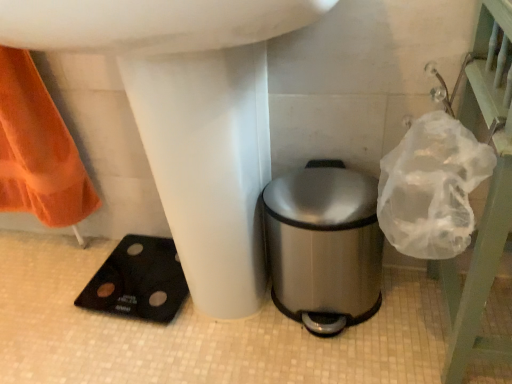
What is the approximate height of stainless steel trash can at lower right?

stainless steel trash can at lower right is 12.86 inches in height.

The height and width of the screenshot is (384, 512). In order to click on white glossy sink at center in this screenshot , I will do `click(189, 117)`.

Considering the relative sizes of white glossy sink at center and stainless steel trash can at lower right in the image provided, is white glossy sink at center shorter than stainless steel trash can at lower right?

Incorrect, the height of white glossy sink at center does not fall short of that of stainless steel trash can at lower right.

Considering the points (156, 167) and (291, 270), which point is behind, point (156, 167) or point (291, 270)?

The point (291, 270) is farther.

Considering the relative sizes of white glossy sink at center and stainless steel trash can at lower right in the image provided, is white glossy sink at center smaller than stainless steel trash can at lower right?

Incorrect, white glossy sink at center is not smaller in size than stainless steel trash can at lower right.

How far apart are white glossy sink at center and stainless steel trash can at lower right?

white glossy sink at center is 7.47 inches away from stainless steel trash can at lower right.

Is white glossy sink at center oriented away from clear plastic bag at upper right?

white glossy sink at center is not turned away from clear plastic bag at upper right.

Would you say white glossy sink at center is inside or outside clear plastic bag at upper right?

white glossy sink at center is not enclosed by clear plastic bag at upper right.

Considering the relative sizes of white glossy sink at center and clear plastic bag at upper right in the image provided, is white glossy sink at center bigger than clear plastic bag at upper right?

Yes, white glossy sink at center is bigger than clear plastic bag at upper right.

Is white glossy sink at center far from clear plastic bag at upper right?

No, white glossy sink at center is not far from clear plastic bag at upper right.

This screenshot has width=512, height=384. In the image, there is a stainless steel trash can at lower right. Find the location of `balustrade above it (from the image's perspective)`. balustrade above it (from the image's perspective) is located at coordinates (488, 192).

Which object is more forward, clear plastic bag at upper right or stainless steel trash can at lower right?

clear plastic bag at upper right is closer to the camera.

Consider the image. Is clear plastic bag at upper right oriented towards stainless steel trash can at lower right?

Yes, clear plastic bag at upper right is facing stainless steel trash can at lower right.

Who is smaller, clear plastic bag at upper right or stainless steel trash can at lower right?

stainless steel trash can at lower right is smaller.

The height and width of the screenshot is (384, 512). What are the coordinates of `waste container on the left of clear plastic bag at upper right` in the screenshot? It's located at (324, 246).

From the image's perspective, between stainless steel trash can at lower right and clear plastic bag at upper right, who is located below?

stainless steel trash can at lower right.

From a real-world perspective, which is physically above, stainless steel trash can at lower right or clear plastic bag at upper right?

In real-world perspective, clear plastic bag at upper right is above.

Find the location of `waste container on the right of white glossy sink at center`. waste container on the right of white glossy sink at center is located at coordinates (324, 246).

How many degrees apart are the facing directions of stainless steel trash can at lower right and white glossy sink at center?

There is a 4.16-degree angle between the facing directions of stainless steel trash can at lower right and white glossy sink at center.

From the image's perspective, which one is positioned higher, stainless steel trash can at lower right or white glossy sink at center?

white glossy sink at center.

Does stainless steel trash can at lower right touch white glossy sink at center?

stainless steel trash can at lower right is not next to white glossy sink at center, and they're not touching.

Which object is positioned more to the right, clear plastic bag at upper right or white glossy sink at center?

clear plastic bag at upper right.

From a real-world perspective, is clear plastic bag at upper right under white glossy sink at center?

Indeed, from a real-world perspective, clear plastic bag at upper right is positioned beneath white glossy sink at center.

In the scene shown: Considering the sizes of clear plastic bag at upper right and white glossy sink at center in the image, is clear plastic bag at upper right wider or thinner than white glossy sink at center?

clear plastic bag at upper right is thinner than white glossy sink at center.

Locate an element on the screen. sink lying above the stainless steel trash can at lower right (from the image's perspective) is located at coordinates (189, 117).

Locate an element on the screen. Image resolution: width=512 pixels, height=384 pixels. balustrade behind the white glossy sink at center is located at coordinates (488, 192).

When comparing their distances from clear plastic bag at upper right, does stainless steel trash can at lower right or white glossy sink at center seem closer?

stainless steel trash can at lower right is closer to clear plastic bag at upper right.

Considering their positions, is stainless steel trash can at lower right positioned closer to white glossy sink at center than clear plastic bag at upper right?

Among the two, stainless steel trash can at lower right is located nearer to white glossy sink at center.

Based on their spatial positions, is clear plastic bag at upper right or white glossy sink at center further from stainless steel trash can at lower right?

clear plastic bag at upper right is positioned further to the anchor stainless steel trash can at lower right.

From the image, which object appears to be farther from clear plastic bag at upper right, white glossy sink at center or stainless steel trash can at lower right?

white glossy sink at center.

Consider the image. Considering their positions, is clear plastic bag at upper right positioned closer to white glossy sink at center than stainless steel trash can at lower right?

The object closer to white glossy sink at center is stainless steel trash can at lower right.

From the image, which object appears to be nearer to stainless steel trash can at lower right, white glossy sink at center or clear plastic bag at upper right?

Among the two, white glossy sink at center is located nearer to stainless steel trash can at lower right.

You are a GUI agent. You are given a task and a screenshot of the screen. Output one action in this format:
    pyautogui.click(x=<x>, y=<y>)
    Task: Click on the waste container between white glossy sink at center and clear plastic bag at upper right
    
    Given the screenshot: What is the action you would take?
    pyautogui.click(x=324, y=246)